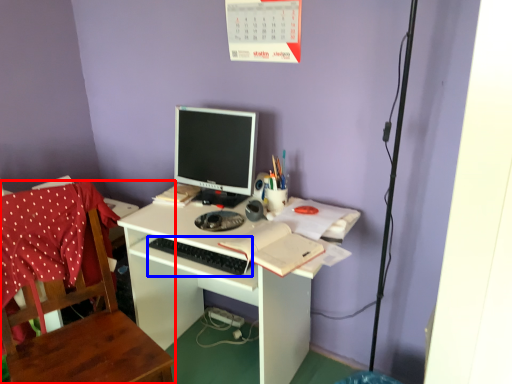
Question: Which of the following is the closest to the observer, chair (highlighted by a red box) or computer keyboard (highlighted by a blue box)?

Choices:
 (A) chair
 (B) computer keyboard

Answer: (A)